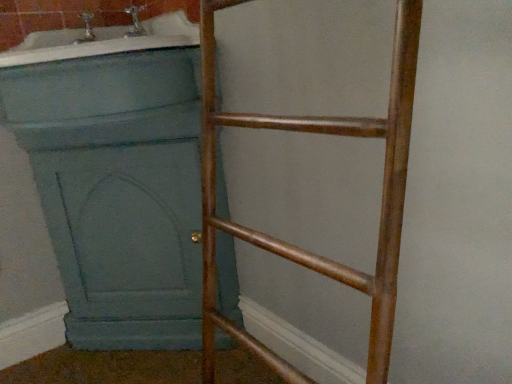
Question: Is matte blue bathtub at upper left outside teal painted wood screen door at left?

Choices:
 (A) yes
 (B) no

Answer: (A)

Question: Is matte blue bathtub at upper left placed right next to teal painted wood screen door at left?

Choices:
 (A) yes
 (B) no

Answer: (B)

Question: Is matte blue bathtub at upper left shorter than teal painted wood screen door at left?

Choices:
 (A) no
 (B) yes

Answer: (B)

Question: Is matte blue bathtub at upper left closer to the viewer compared to teal painted wood screen door at left?

Choices:
 (A) no
 (B) yes

Answer: (B)

Question: Is teal painted wood screen door at left at the back of matte blue bathtub at upper left?

Choices:
 (A) yes
 (B) no

Answer: (B)

Question: Would you say matte blue bathtub at upper left is a long distance from teal painted wood screen door at left?

Choices:
 (A) yes
 (B) no

Answer: (B)

Question: Is bronze metallic ladder at right positioned in front of matte blue bathtub at upper left?

Choices:
 (A) yes
 (B) no

Answer: (A)

Question: From the image's perspective, would you say bronze metallic ladder at right is positioned over matte blue bathtub at upper left?

Choices:
 (A) no
 (B) yes

Answer: (A)

Question: Does bronze metallic ladder at right contain matte blue bathtub at upper left?

Choices:
 (A) no
 (B) yes

Answer: (A)

Question: Does bronze metallic ladder at right have a larger size compared to matte blue bathtub at upper left?

Choices:
 (A) yes
 (B) no

Answer: (A)

Question: Does bronze metallic ladder at right have a lesser width compared to matte blue bathtub at upper left?

Choices:
 (A) yes
 (B) no

Answer: (A)

Question: From a real-world perspective, is bronze metallic ladder at right beneath matte blue bathtub at upper left?

Choices:
 (A) no
 (B) yes

Answer: (B)

Question: Considering the relative sizes of teal painted wood screen door at left and matte blue bathtub at upper left in the image provided, is teal painted wood screen door at left thinner than matte blue bathtub at upper left?

Choices:
 (A) no
 (B) yes

Answer: (B)